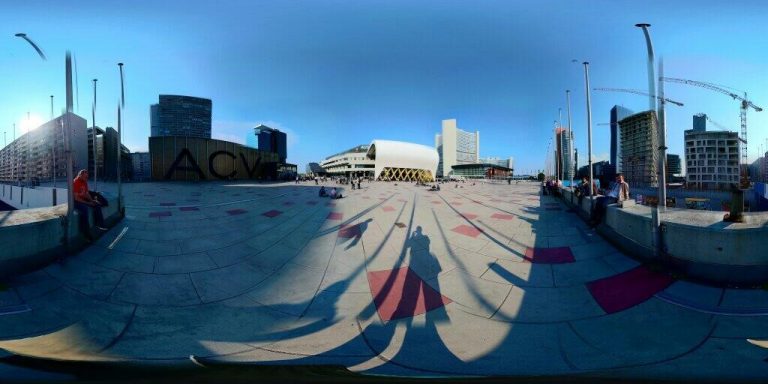
Find the location of a particular element. This screenshot has height=384, width=768. wall is located at coordinates (739, 272).